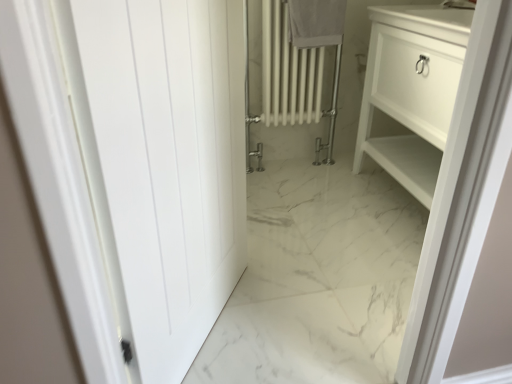
Measure the distance between point (412, 125) and camera.

Point (412, 125) is 1.68 meters from camera.

Locate an element on the screen. This screenshot has width=512, height=384. white cotton towel at upper center is located at coordinates (316, 22).

Is white matte door at left outside of white cotton towel at upper center?

Yes, white matte door at left is not within white cotton towel at upper center.

From a real-world perspective, does white matte door at left sit lower than white cotton towel at upper center?

Correct, in the physical world, white matte door at left is lower than white cotton towel at upper center.

Identify the location of door below the white cotton towel at upper center (from a real-world perspective). (164, 165).

From the image's perspective, is white matte door at left located above or below white cotton towel at upper center?

From the image's perspective, white matte door at left appears below white cotton towel at upper center.

From a real-world perspective, which object stands above the other?

white matte door at left.

You are a GUI agent. You are given a task and a screenshot of the screen. Output one action in this format:
    pyautogui.click(x=<x>, y=<y>)
    Task: Click on the door that is on the left side of white glossy cabinet at right
    
    Given the screenshot: What is the action you would take?
    pyautogui.click(x=164, y=165)

What's the angular difference between white matte door at left and white glossy cabinet at right's facing directions?

They differ by 150 degrees in their facing directions.

Considering the relative sizes of white matte door at left and white glossy cabinet at right in the image provided, is white matte door at left wider than white glossy cabinet at right?

No, white matte door at left is not wider than white glossy cabinet at right.

From a real-world perspective, is white glossy cabinet at right on white cotton towel at upper center?

No, from a real-world perspective, white glossy cabinet at right is not above white cotton towel at upper center.

From the image's perspective, is white glossy cabinet at right located above white cotton towel at upper center?

Actually, white glossy cabinet at right appears below white cotton towel at upper center in the image.

Does white glossy cabinet at right have a greater width compared to white cotton towel at upper center?

Yes, white glossy cabinet at right is wider than white cotton towel at upper center.

Is white glossy cabinet at right next to white cotton towel at upper center and touching it?

No, white glossy cabinet at right is not touching white cotton towel at upper center.

From the image's perspective, between white cotton towel at upper center and white matte door at left, who is located below?

white matte door at left is shown below in the image.

At what (x,y) coordinates should I click in order to perform the action: click on bath towel above the white matte door at left (from the image's perspective). Please return your answer as a coordinate pair (x, y). Looking at the image, I should click on (316, 22).

Choose the correct answer: Is white cotton towel at upper center inside white matte door at left or outside it?

The correct answer is: outside.

From a real-world perspective, relative to white matte door at left, is white cotton towel at upper center vertically above or below?

From a real-world perspective, white cotton towel at upper center is physically above white matte door at left.

From a real-world perspective, which is physically below, white cotton towel at upper center or white glossy cabinet at right?

In real-world perspective, white glossy cabinet at right is lower.

Is there a large distance between white cotton towel at upper center and white glossy cabinet at right?

They are positioned close to each other.

Is white cotton towel at upper center inside the boundaries of white glossy cabinet at right, or outside?

The correct answer is: outside.

Which object is wider, white cotton towel at upper center or white glossy cabinet at right?

white glossy cabinet at right is wider.

Is white glossy cabinet at right placed right next to white matte door at left?

They are not placed beside each other.

Does white glossy cabinet at right have a lesser height compared to white matte door at left?

Yes, white glossy cabinet at right is shorter than white matte door at left.

How many degrees apart are the facing directions of white glossy cabinet at right and white matte door at left?

150 degrees separate the facing orientations of white glossy cabinet at right and white matte door at left.

You are a GUI agent. You are given a task and a screenshot of the screen. Output one action in this format:
    pyautogui.click(x=<x>, y=<y>)
    Task: Click on the door in front of the white cotton towel at upper center
    The height and width of the screenshot is (384, 512).
    Given the screenshot: What is the action you would take?
    pyautogui.click(x=164, y=165)

Identify the location of bathroom cabinet that is behind the white matte door at left. click(412, 90).

Based on their spatial positions, is white matte door at left or white glossy cabinet at right closer to white cotton towel at upper center?

white glossy cabinet at right.

From the image, which object appears to be nearer to white glossy cabinet at right, white cotton towel at upper center or white matte door at left?

Based on the image, white cotton towel at upper center appears to be nearer to white glossy cabinet at right.

From the image, which object appears to be nearer to white cotton towel at upper center, white glossy cabinet at right or white matte door at left?

white glossy cabinet at right is positioned closer to the anchor white cotton towel at upper center.

Which object lies further to the anchor point white glossy cabinet at right, white matte door at left or white cotton towel at upper center?

white matte door at left.

Considering their positions, is white glossy cabinet at right positioned closer to white matte door at left than white cotton towel at upper center?

white glossy cabinet at right is positioned closer to the anchor white matte door at left.

When comparing their distances from white matte door at left, does white cotton towel at upper center or white glossy cabinet at right seem further?

Based on the image, white cotton towel at upper center appears to be further to white matte door at left.

Image resolution: width=512 pixels, height=384 pixels. I want to click on bathroom cabinet located between white matte door at left and white cotton towel at upper center in the depth direction, so click(x=412, y=90).